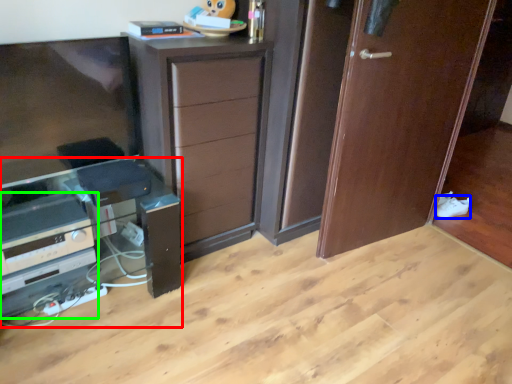
Question: Which is nearer to the computer desk (highlighted by a red box)? shoe (highlighted by a blue box) or appliance (highlighted by a green box).

Choices:
 (A) shoe
 (B) appliance

Answer: (B)